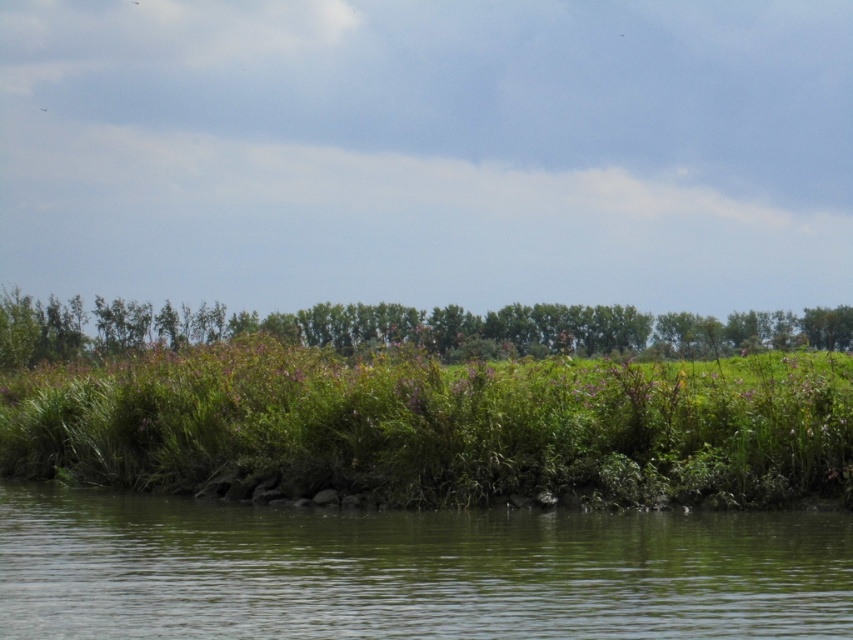
You are standing at the edge of the water in the image and want to know which object is larger in size between the green smooth water at lower center and the green leafy trees at upper center. Can you tell me?

The green smooth water at lower center has a smaller size compared to the green leafy trees at upper center, so the green leafy trees at upper center are larger in size.

You are planning to build a small boat dock that is 25 meters long. You want to place it so that it starts at the edge of the green smooth water at lower center and extends towards the green leafy trees at upper center. Will the dock fit entirely within the space between them?

The distance between the green smooth water at lower center and the green leafy trees at upper center is 26.20 meters. Since the dock is 25 meters long, it will fit entirely within the space between them with 1.20 meters to spare.